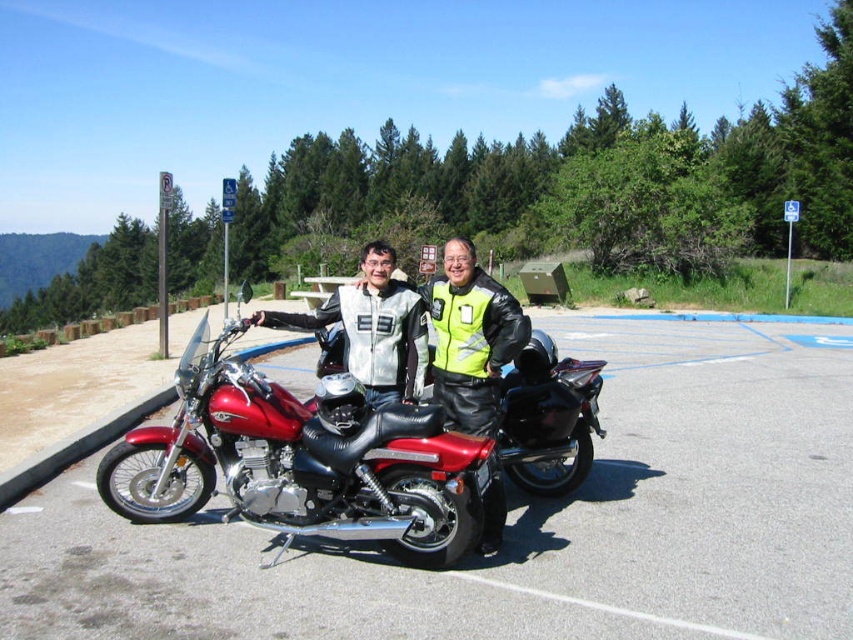
You are planning to park your car in the parking area shown in the image. You notice the shiny red motorcycle at center and the matte black motorcycle at center. Which motorcycle takes up more space in the parking area?

The shiny red motorcycle at center has a larger size compared to the matte black motorcycle at center, so it takes up more space in the parking area.

You are a photographer standing at the camera position. You want to take a photo of the metallic red motorcycle at center. The motorcycle is 3.49 meters away from you. Your camera has a focal length of 50mm. What is the approximate angle of view required to capture the entire motorcycle in the frame?

The metallic red motorcycle at center is 3.49 meters from the camera. Using the formula for angle of view, which is 2 times arctangent of the subject height divided by twice the distance, you would need to know the motorcycle height. Since the motorcycle height isn t provided, we can estimate based on typical motorcycle dimensions. Most motorcycles are around 1 meter tall. Plugging into the formula, angle of view would be approximately 2 times arctangent of 1 divided by 6.98, resulting in roughly 17 degrees